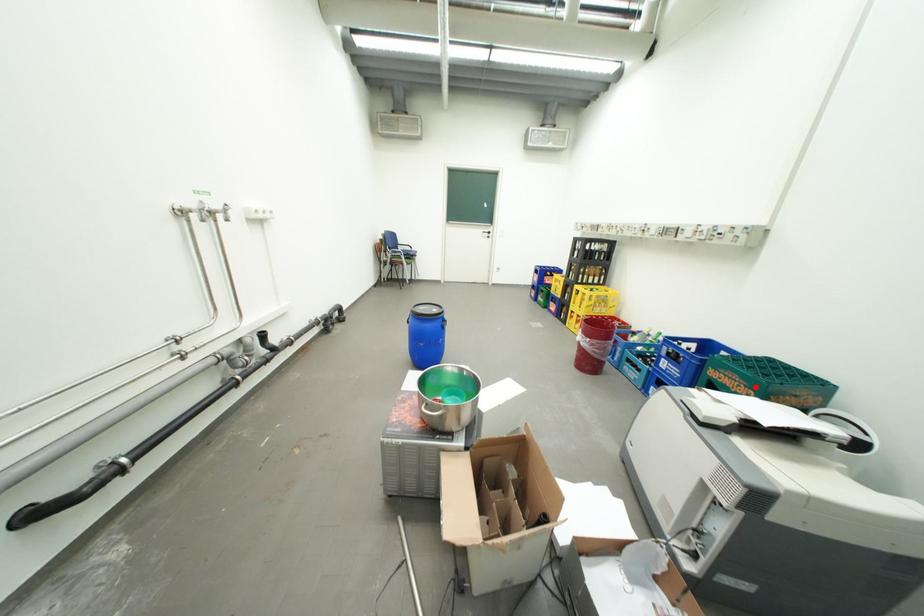
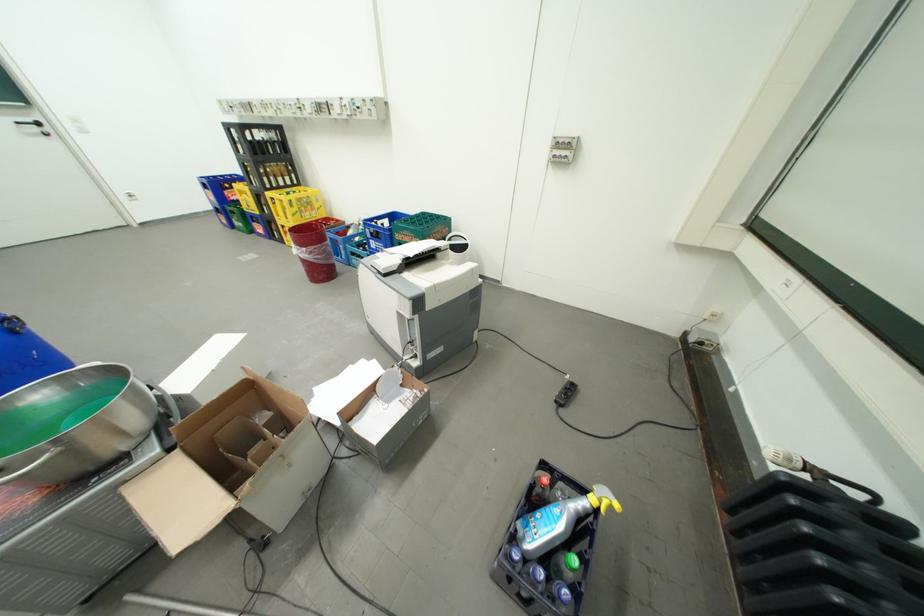
Locate, in the second image, the point that corresponds to the highlighted location in the first image.

(424, 238)